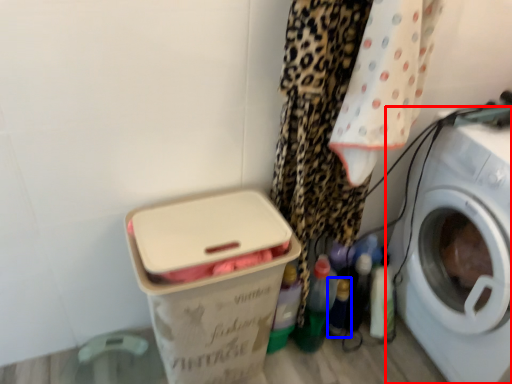
Question: Which point is further to the camera, washing machine (highlighted by a red box) or bottle (highlighted by a blue box)?

Choices:
 (A) washing machine
 (B) bottle

Answer: (B)